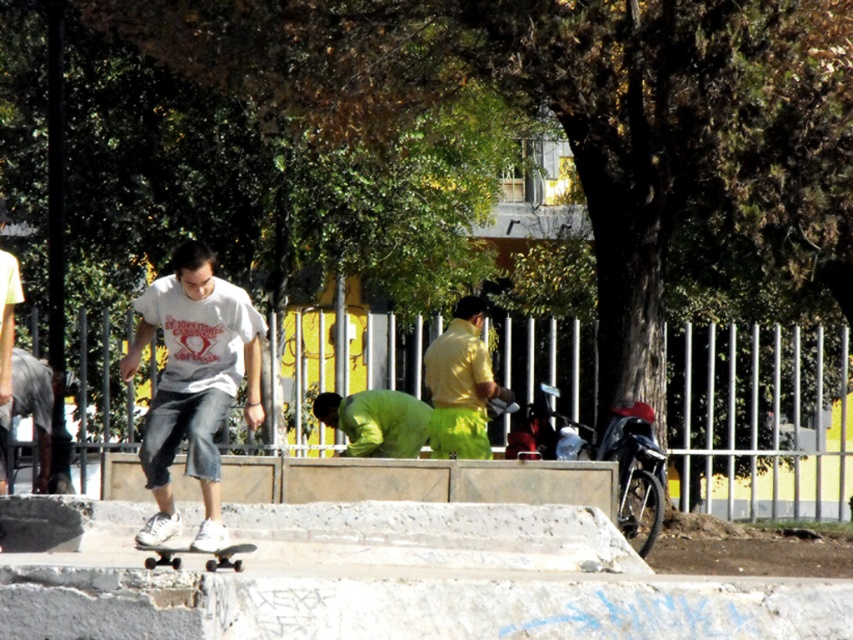
Question: Does green matte shirt at center have a lesser width compared to white matte skateboard at center?

Choices:
 (A) no
 (B) yes

Answer: (A)

Question: Which object is closer to the camera taking this photo?

Choices:
 (A) green matte shirt at center
 (B) white matte t-shirt at center
 (C) white matte skateboard at center

Answer: (C)

Question: In this image, where is green matte shirt at center located relative to white matte skateboard at center?

Choices:
 (A) left
 (B) right

Answer: (B)

Question: Among these points, which one is nearest to the camera?

Choices:
 (A) (450, 392)
 (B) (149, 563)
 (C) (405, 420)
 (D) (146, 445)

Answer: (B)

Question: Can you confirm if white matte t-shirt at center is positioned to the left of green matte shirt at center?

Choices:
 (A) yes
 (B) no

Answer: (A)

Question: Which point is farther from the camera taking this photo?

Choices:
 (A) (438, 452)
 (B) (206, 564)

Answer: (A)